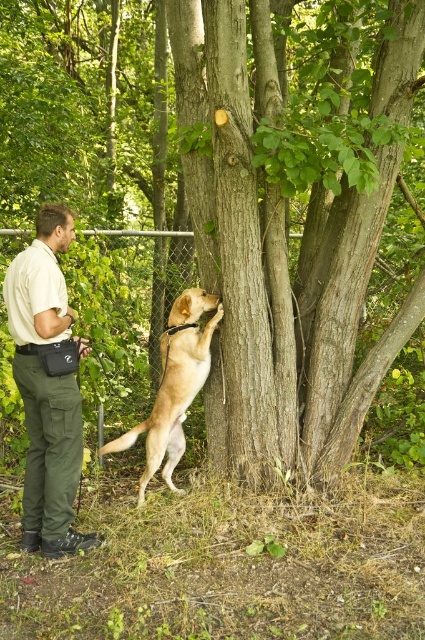
You are a photographer trying to capture a photo of the khaki cotton shirt at center and the golden fur dog at center. Which object should you focus on first if you want to include both in the frame without moving the camera?

The khaki cotton shirt at center is positioned on the left side of golden fur dog at center, so you should focus on the khaki cotton shirt at center first to ensure both are in frame without moving the camera.

You are a photographer trying to capture a photo of the khaki cotton shirt at center and the golden fur dog at center. Which one should you focus on first if you want to ensure both are in frame without moving the camera?

The khaki cotton shirt at center has a smaller size compared to golden fur dog at center, so you should focus on the golden fur dog at center first to ensure it fits in the frame, then adjust for the smaller khaki cotton shirt at center.

You are a photographer trying to capture a photo of the khaki cotton shirt at center and the golden fur dog at center. Since you want both subjects to be in focus, you need to know their heights. Can you determine which one is taller?

The khaki cotton shirt at center is much taller than the golden fur dog at center.